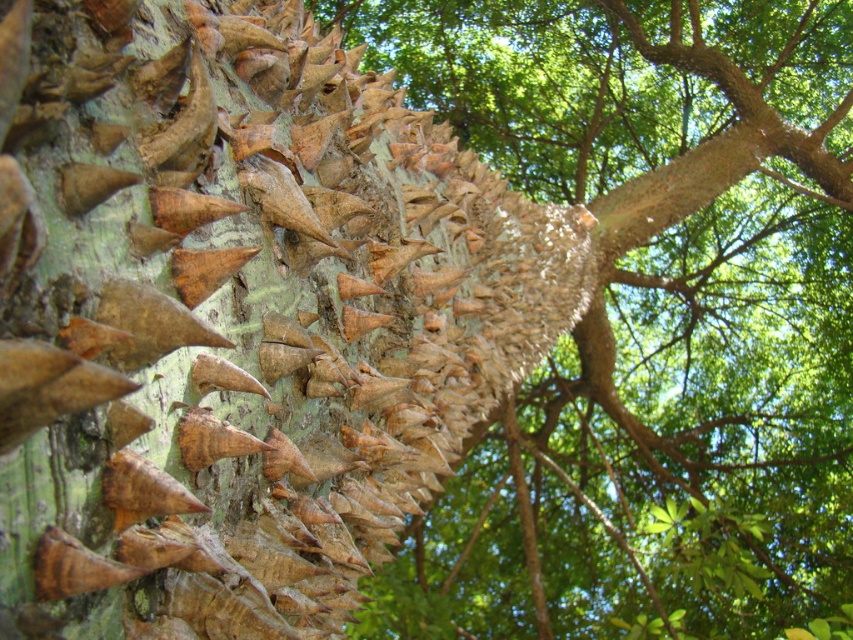
Question: Does green rough bark at center lie behind brown rough bark at center?

Choices:
 (A) yes
 (B) no

Answer: (B)

Question: Can you confirm if green rough bark at center is positioned to the right of brown rough bark at center?

Choices:
 (A) no
 (B) yes

Answer: (A)

Question: Does green rough bark at center appear on the right side of brown rough bark at center?

Choices:
 (A) yes
 (B) no

Answer: (B)

Question: Which object appears farthest from the camera in this image?

Choices:
 (A) brown rough bark at center
 (B) green rough bark at center

Answer: (A)

Question: Which of the following is the closest to the observer?

Choices:
 (A) (508, 349)
 (B) (634, 289)

Answer: (A)

Question: Which object appears closest to the camera in this image?

Choices:
 (A) brown rough bark at center
 (B) green rough bark at center

Answer: (B)